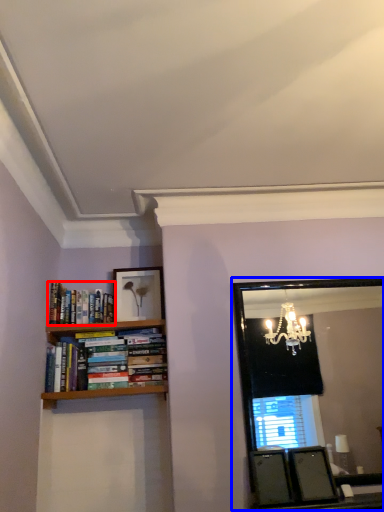
Question: Which object appears farthest to the camera in this image, book (highlighted by a red box) or mirror (highlighted by a blue box)?

Choices:
 (A) book
 (B) mirror

Answer: (A)